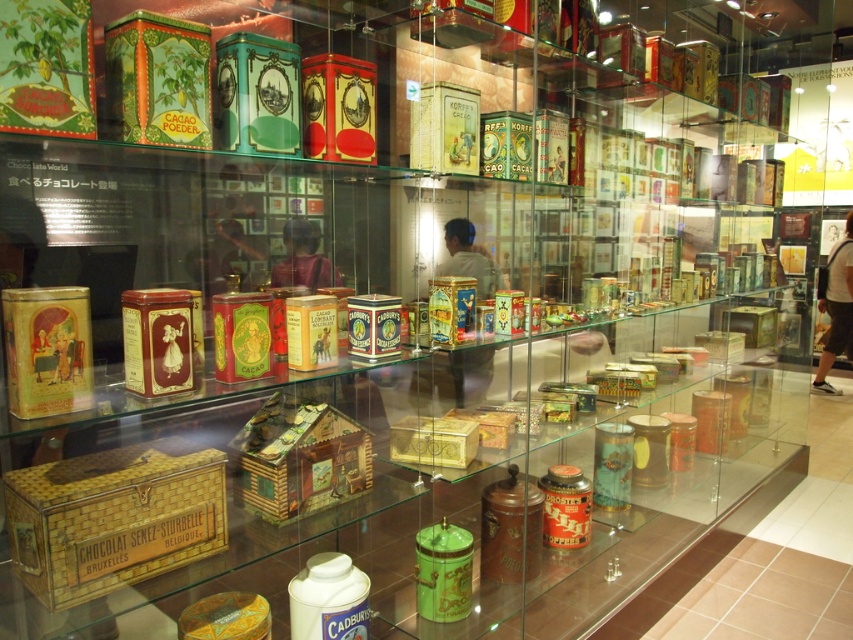
You are a visitor standing in front of the glass display case. You want to take a photo of the wooden house at center without the gold wicker box at lower left blocking the view. Is it possible?

The gold wicker box at lower left is in front of the wooden house at center, so it will block the view. To take a photo of the wooden house at center without the gold wicker box at lower left blocking the view, you need to move to a position where the gold wicker box at lower left is not in front of the wooden house at center.

Please provide the exact 2D coordinates of the gold wicker box at lower left in the display case.

The gold wicker box at lower left is located at the 2D coordinates of point (114,516).

You are a museum visitor standing in front of the glass display case. You notice the wooden house at center and the gold metallic box at center. Which object is placed higher in the display?

The wooden house at center is positioned over the gold metallic box at center, so it is placed higher in the display.